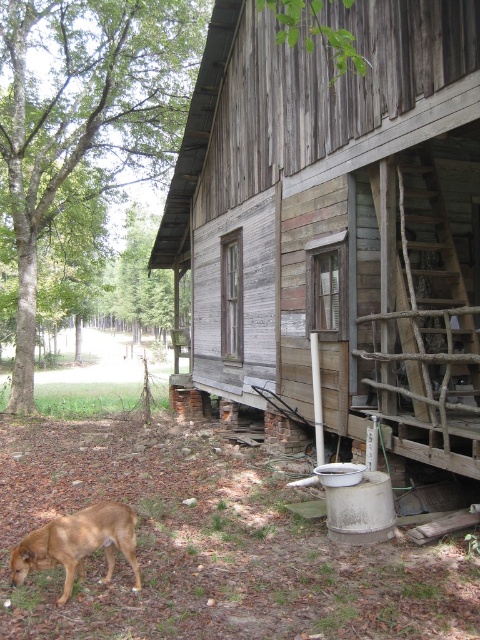
Does weathered wood cabin at center lie behind brown furry dog at lower left?

Yes, weathered wood cabin at center is behind brown furry dog at lower left.

Between weathered wood cabin at center and brown furry dog at lower left, which one is positioned lower?

Positioned lower is brown furry dog at lower left.

Identify the location of weathered wood cabin at center. (337, 221).